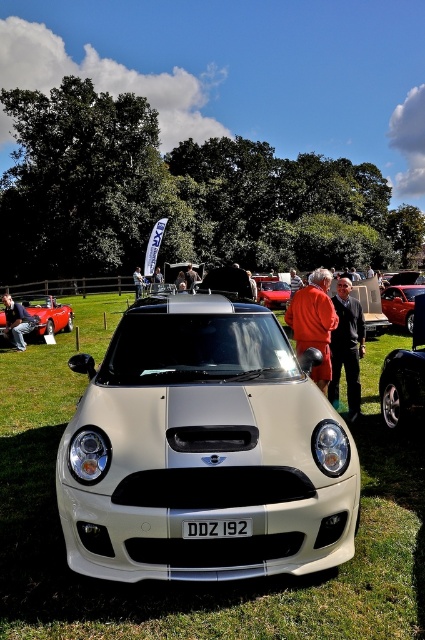
You are a photographer at the car show and need to capture both the orange fabric coat at center and the shiny red car at center in a single frame. Considering their sizes, which object should you position closer to the camera to ensure both fit well in the photo?

The orange fabric coat at center is larger than the shiny red car at center. To ensure both fit well in the photo, position the orange fabric coat at center closer to the camera since it is larger and requires more space in the frame.